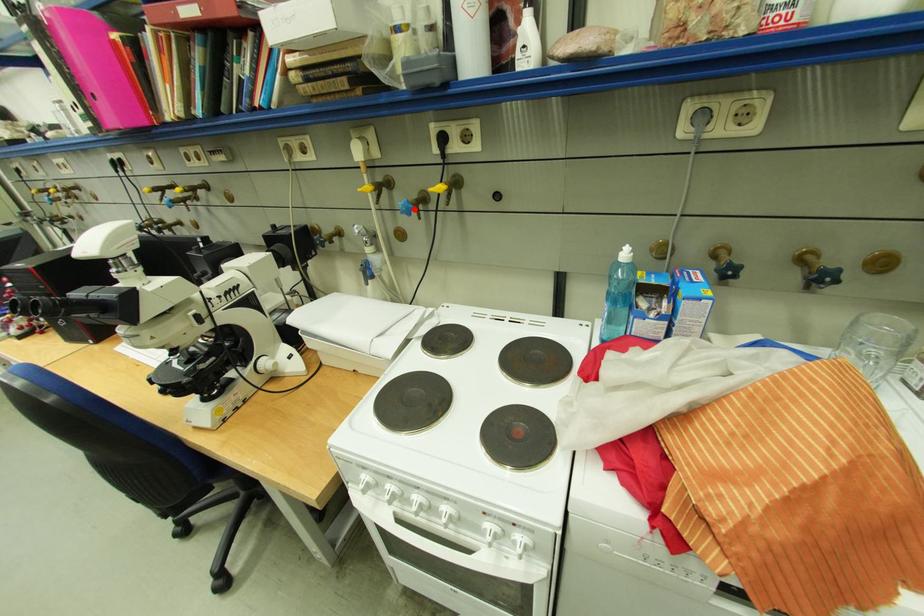
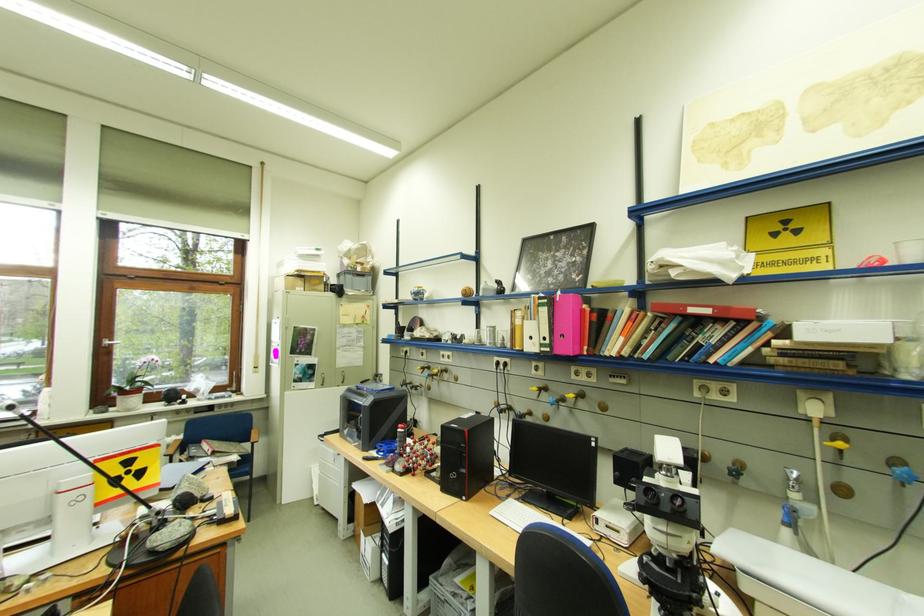
The point at the highlighted location is marked in the first image. Where is the corresponding point in the second image?

(916, 477)